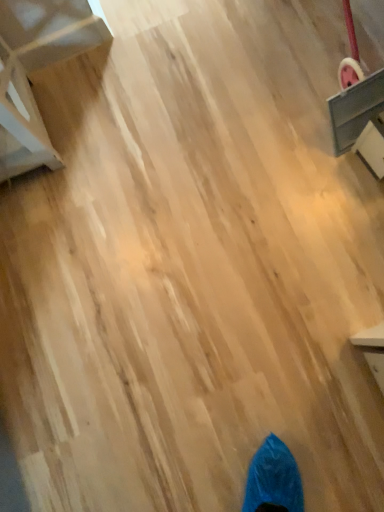
Where is `vacant area that is situated to the right of white matte chair at upper left, positioned as the 1th furniture in left-to-right order`? This screenshot has height=512, width=384. vacant area that is situated to the right of white matte chair at upper left, positioned as the 1th furniture in left-to-right order is located at coordinates (101, 99).